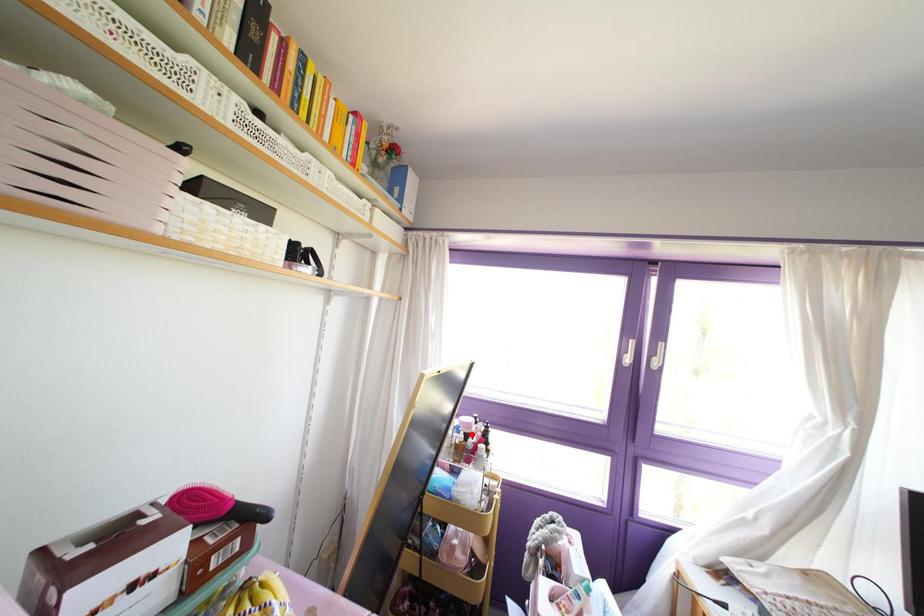
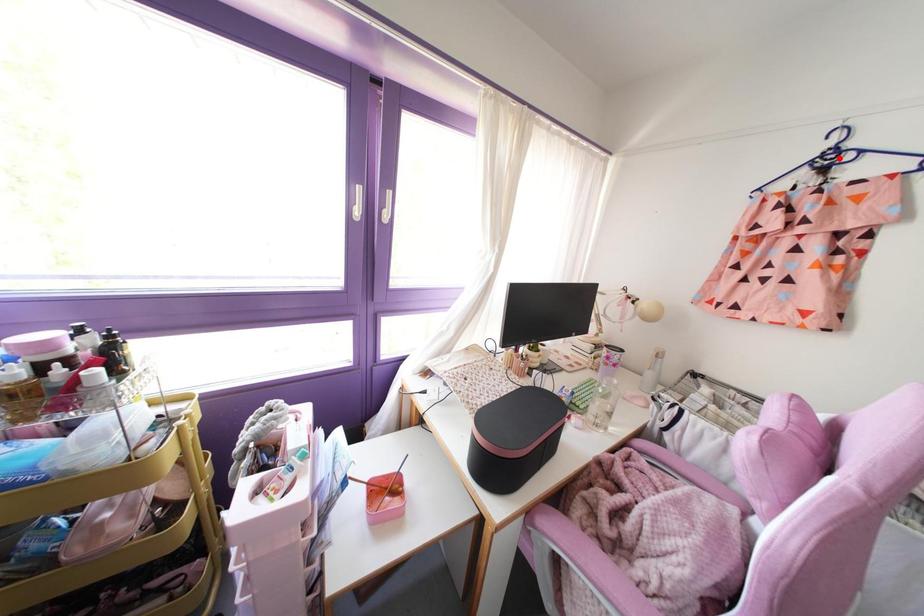
I am providing you with two images of the same scene from different viewpoints. A red point is marked on the first image and another point is marked on the second image. Are the points marked in image1 and image2 representing the same 3D position?

No